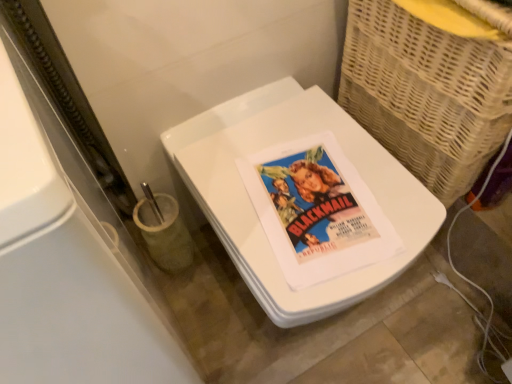
Question: Is white glossy toilet at center facing towards woven wicker basket at right?

Choices:
 (A) no
 (B) yes

Answer: (A)

Question: From the image's perspective, is white glossy toilet at center located beneath woven wicker basket at right?

Choices:
 (A) no
 (B) yes

Answer: (B)

Question: Does white glossy toilet at center have a larger size compared to woven wicker basket at right?

Choices:
 (A) yes
 (B) no

Answer: (A)

Question: Is white glossy toilet at center completely or partially outside of woven wicker basket at right?

Choices:
 (A) no
 (B) yes

Answer: (B)

Question: Is woven wicker basket at right located within white glossy toilet at center?

Choices:
 (A) yes
 (B) no

Answer: (B)

Question: In terms of size, does matte paper poster at center appear bigger or smaller than woven wicker basket at right?

Choices:
 (A) big
 (B) small

Answer: (B)

Question: Is matte paper poster at center to the left or to the right of woven wicker basket at right in the image?

Choices:
 (A) left
 (B) right

Answer: (A)

Question: In the image, is matte paper poster at center positioned in front of or behind woven wicker basket at right?

Choices:
 (A) front
 (B) behind

Answer: (B)

Question: From the image's perspective, is matte paper poster at center positioned above or below woven wicker basket at right?

Choices:
 (A) above
 (B) below

Answer: (B)

Question: From the image's perspective, is white glossy toilet at center located above or below woven wicker basket at right?

Choices:
 (A) below
 (B) above

Answer: (A)

Question: From a real-world perspective, is white glossy toilet at center above or below woven wicker basket at right?

Choices:
 (A) below
 (B) above

Answer: (A)

Question: Is white glossy toilet at center taller or shorter than woven wicker basket at right?

Choices:
 (A) tall
 (B) short

Answer: (B)

Question: Do you think white glossy toilet at center is within woven wicker basket at right, or outside of it?

Choices:
 (A) inside
 (B) outside

Answer: (B)

Question: Considering the relative positions of woven wicker basket at right and white glossy toilet at center in the image provided, is woven wicker basket at right to the left or to the right of white glossy toilet at center?

Choices:
 (A) left
 (B) right

Answer: (B)

Question: From a real-world perspective, is woven wicker basket at right physically located above or below white glossy toilet at center?

Choices:
 (A) below
 (B) above

Answer: (B)